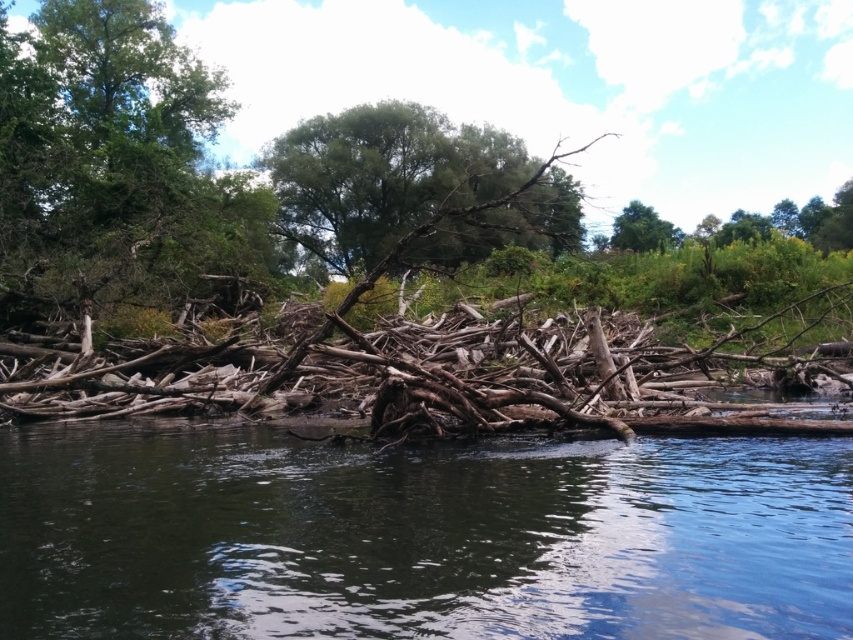
You are a hiker trying to cross the river using the logs. You notice the dark brown wood at center and the green leafy tree at center. Which object takes up more space in the scene?

The green leafy tree at center occupies more space than the dark brown wood at center, so the green leafy tree at center takes up more space in the scene.

You are a hiker who wants to cross the river using the logs. You have a 15 feet long rope. Can you tie the dark brown wood at center and the brown rough driftwood at center together with the rope?

The dark brown wood at center and brown rough driftwood at center are 17.70 feet apart from each other. Since the rope is only 15 feet long, it is not long enough to connect them.